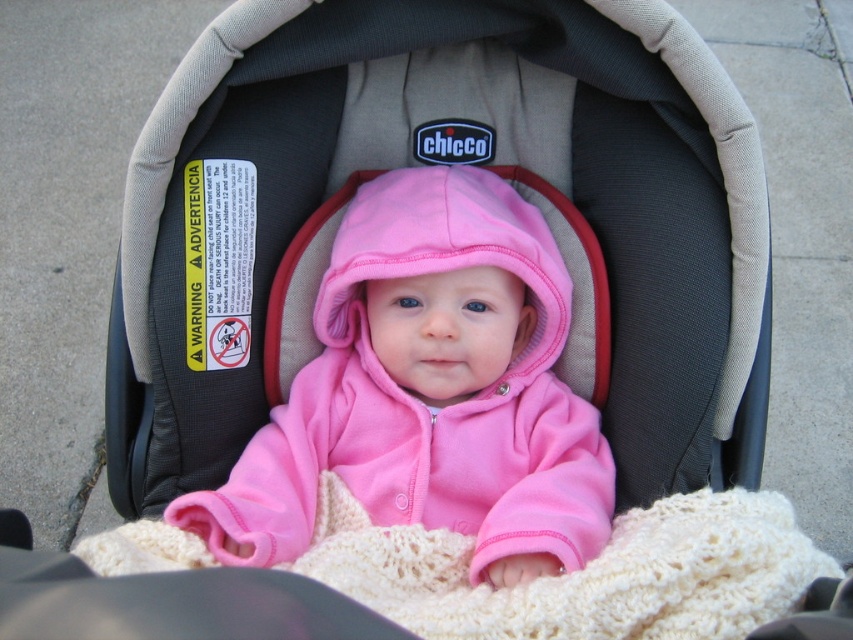
You are a childcare provider observing the baby in the car seat. You notice both the pink fleece baby at center and the creamy knit blanket at center. Which object takes up more space in the image?

The pink fleece baby at center is larger in size than the creamy knit blanket at center, so it takes up more space in the image.

You are a childcare provider looking after a baby in a car seat. You notice the pink fleece baby at center and the creamy knit blanket at center. Which object is closer to you?

The pink fleece baby at center is closer to you because the creamy knit blanket at center is behind it.

Based on the coordinates provided in the scene description, where is the pink fleece baby at center located?

The pink fleece baby at center is located at the 2D coordinates point [428,390].